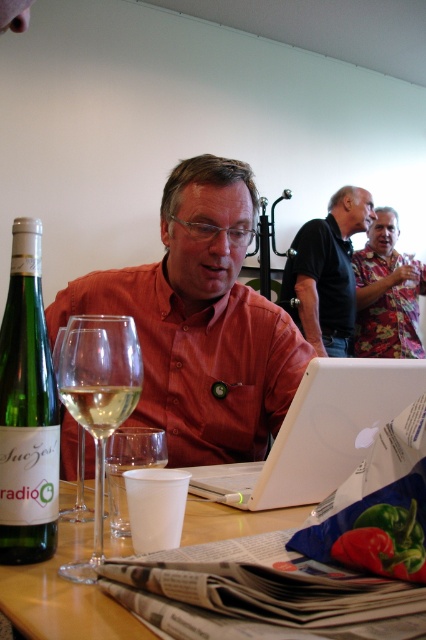
You are a delivery robot with a 12 inch wide package. You need to place it on the table between the matte orange shirt at center and the white plastic laptop at center. Is there enough space between them to fit the package?

The matte orange shirt at center and white plastic laptop at center are 11.50 inches apart from each other. Since the package is 12 inches wide, it is slightly wider than the available space. Therefore, the package cannot be placed between them without overlapping.

You are standing at the center of the image and want to reach the floral fabric shirt at upper right. Which direction should you move in to get closer to it?

The floral fabric shirt at upper right is located at point (386, 292), so you should move towards the upper right direction to get closer to it.